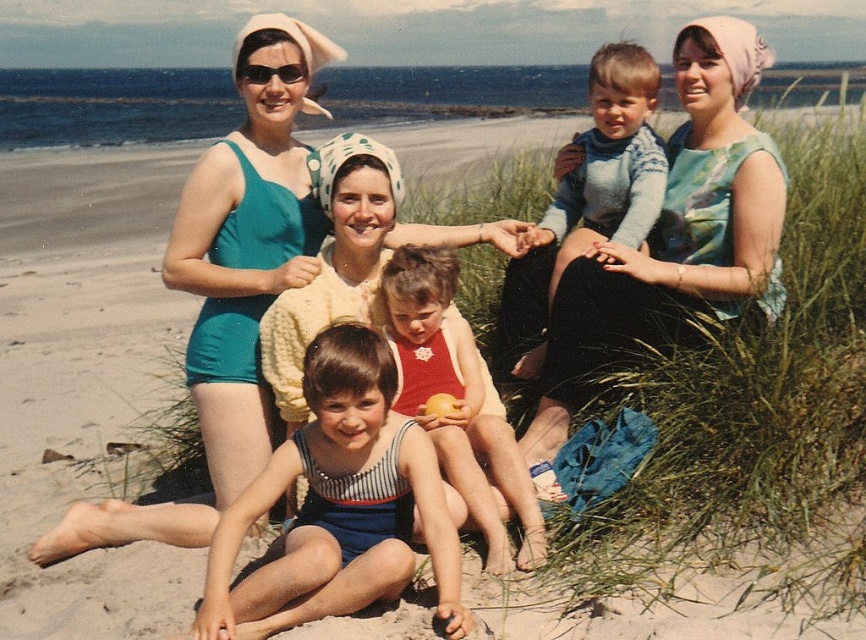
Who is positioned more to the right, floral dress at center or knitted sweater at center?

From the viewer's perspective, floral dress at center appears more on the right side.

Which is behind, point (727, 300) or point (651, 99)?

The point (651, 99) is more distant.

Does point (656, 323) come closer to viewer compared to point (638, 184)?

Yes, point (656, 323) is closer to viewer.

I want to click on floral dress at center, so click(x=677, y=230).

Who is shorter, striped fabric swimsuit at center or floral dress at center?

With less height is striped fabric swimsuit at center.

Looking at this image, can you confirm if striped fabric swimsuit at center is shorter than floral dress at center?

Indeed, striped fabric swimsuit at center has a lesser height compared to floral dress at center.

Find the location of a particular element. This screenshot has height=640, width=866. striped fabric swimsuit at center is located at coordinates (338, 504).

Where is `striped fabric swimsuit at center`? This screenshot has width=866, height=640. striped fabric swimsuit at center is located at coordinates (338, 504).

Between point (764, 307) and point (527, 557), which one is positioned behind?

The point (764, 307) is more distant.

Is floral dress at center taller than red swimsuit at center?

Yes, floral dress at center is taller than red swimsuit at center.

Find the location of a particular element. Image resolution: width=866 pixels, height=640 pixels. floral dress at center is located at coordinates (677, 230).